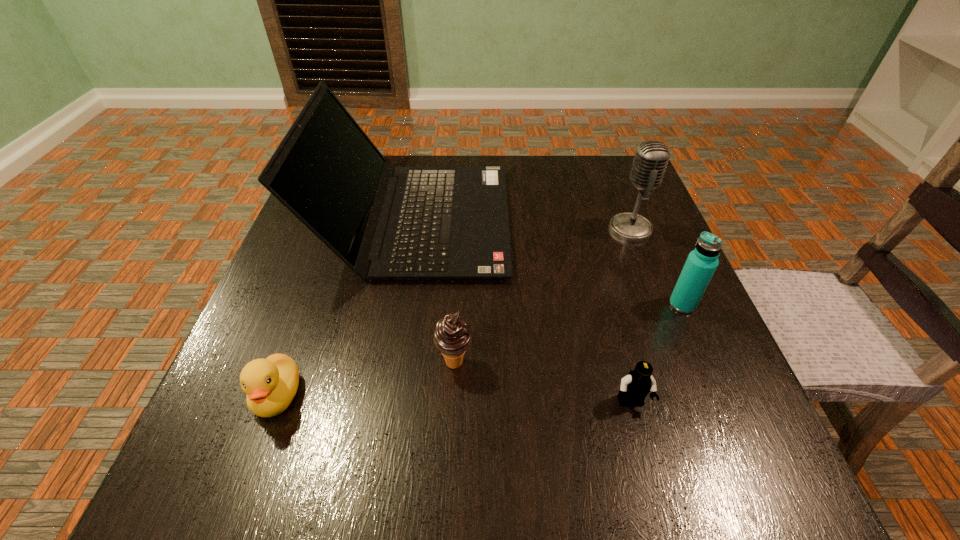
Where is `laptop computer`? laptop computer is located at coordinates (413, 223).

In order to click on microphone in this screenshot , I will do click(x=651, y=158).

The width and height of the screenshot is (960, 540). I want to click on water bottle, so click(702, 262).

This screenshot has width=960, height=540. In order to click on the fourth nearest object in this screenshot , I will do point(702,262).

Locate an element on the screen. The height and width of the screenshot is (540, 960). the fourth tallest object is located at coordinates click(452, 336).

The height and width of the screenshot is (540, 960). Identify the location of duckling. (270, 384).

Where is `Lego`? This screenshot has width=960, height=540. Lego is located at coordinates (638, 383).

You are a GUI agent. You are given a task and a screenshot of the screen. Output one action in this format:
    pyautogui.click(x=<x>, y=<y>)
    Task: Click on the free space located 0.070m on the screen of the laptop computer
    Image resolution: width=960 pixels, height=540 pixels.
    Given the screenshot: What is the action you would take?
    pyautogui.click(x=538, y=220)

What are the coordinates of `free point located 0.200m on the left of the fifth shortest object` in the screenshot? It's located at 522,228.

This screenshot has height=540, width=960. What are the coordinates of `vacant point located 0.180m on the back of the water bottle` in the screenshot? It's located at (653, 236).